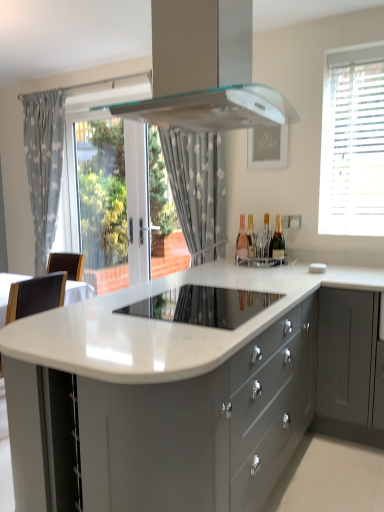
Locate an element on the screen. white blinds at upper right is located at coordinates (352, 142).

Describe the element at coordinates (352, 142) in the screenshot. I see `white blinds at upper right` at that location.

In order to face white glossy countertop at center, should I rotate leftwards or rightwards?

It's best to rotate right around 3.627 degrees.

This screenshot has width=384, height=512. I want to click on matte gold wine bottle at center, which is counted as the second wine bottle, starting from the right, so pyautogui.click(x=265, y=238).

In the scene shown: Measure the distance between high-gloss white cooktop at center and camera.

The depth of high-gloss white cooktop at center is 1.75 meters.

At what (x,y) coordinates should I click in order to perform the action: click on satin silver range hood at upper center. Please return your answer as a coordinate pair (x, y). The height and width of the screenshot is (512, 384). Looking at the image, I should click on click(206, 71).

Identify the location of white blinds at upper right. (352, 142).

What's the angular difference between transparent glass door at left and satin silver range hood at upper center's facing directions?

88.9 degrees separate the facing orientations of transparent glass door at left and satin silver range hood at upper center.

I want to click on window screen lying behind the satin silver range hood at upper center, so click(x=102, y=192).

Are transparent glass door at left and satin silver range hood at upper center making contact?

No, transparent glass door at left is not with satin silver range hood at upper center.

Is the depth of transparent glass door at left less than that of high-gloss white cooktop at center?

No, it is not.

At what (x,y) coordinates should I click in order to perform the action: click on kitchen appliance on the right side of transparent glass door at left. Please return your answer as a coordinate pair (x, y). Looking at the image, I should click on (203, 306).

Which is behind, point (80, 195) or point (237, 314)?

Point (80, 195)

What's the angular difference between transparent glass door at left and white dotted fabric at center, which ranks as the 2th curtain in left-to-right order,'s facing directions?

0.00328 degrees.

From a real-world perspective, who is located lower, transparent glass door at left or white dotted fabric at center, which ranks as the 1th curtain in front-to-back order?

From a 3D spatial view, transparent glass door at left is below.

Is transparent glass door at left far from white dotted fabric at center, placed as the 1th curtain when sorted from right to left?

Indeed, transparent glass door at left is not near white dotted fabric at center, placed as the 1th curtain when sorted from right to left.

Is white dotted fabric at center, which ranks as the 1th curtain in front-to-back order, further to the viewer compared to transparent glass door at center?

No.

In terms of width, does white dotted fabric at center, placed as the 1th curtain when sorted from right to left, look wider or thinner when compared to transparent glass door at center?

In the image, white dotted fabric at center, placed as the 1th curtain when sorted from right to left, appears to be wider than transparent glass door at center.

Would you say white dotted fabric at center, which ranks as the 1th curtain in front-to-back order, is outside transparent glass door at center?

white dotted fabric at center, which ranks as the 1th curtain in front-to-back order, lies outside transparent glass door at center's area.

How far apart are white dotted fabric at center, placed as the 1th curtain when sorted from right to left, and transparent glass door at center?

white dotted fabric at center, placed as the 1th curtain when sorted from right to left, and transparent glass door at center are 7.79 feet apart from each other.

Does white glossy countertop at center lie behind white dotted fabric at center, which ranks as the 2th curtain in left-to-right order?

No, it is in front of white dotted fabric at center, which ranks as the 2th curtain in left-to-right order.

How many degrees apart are the facing directions of white glossy countertop at center and white dotted fabric at center, which ranks as the 2th curtain in left-to-right order?

white glossy countertop at center and white dotted fabric at center, which ranks as the 2th curtain in left-to-right order, are facing 90.5 degrees away from each other.

Starting from the white glossy countertop at center, which curtain is the 1st one behind? Please provide its 2D coordinates.

[(198, 189)]

Measure the distance from white glossy countertop at center to white dotted fabric at center, which is the 2th curtain from back to front.

1.42 meters.

Between black leather chair at left and matte glass wine bottle at center, marked as the third wine bottle in a right-to-left arrangement, which one is positioned in front?

black leather chair at left.

From a real-world perspective, which is physically below, black leather chair at left or matte glass wine bottle at center, marked as the third wine bottle in a right-to-left arrangement?

black leather chair at left is physically lower.

In the scene shown: Who is bigger, black leather chair at left or matte glass wine bottle at center, the 1th wine bottle positioned from the left?

black leather chair at left is bigger.

From a real-world perspective, starting from the pink glass bottle at center, which wine bottle is the 1st one vertically above it? Please provide its 2D coordinates.

[(265, 238)]

From a real-world perspective, relative to pink glass bottle at center, is matte gold wine bottle at center, arranged as the 2th wine bottle when viewed from the left, vertically above or below?

Clearly, from a real-world perspective, matte gold wine bottle at center, arranged as the 2th wine bottle when viewed from the left, is above pink glass bottle at center.

Considering the sizes of objects matte gold wine bottle at center, which is counted as the second wine bottle, starting from the right, and pink glass bottle at center in the image provided, who is smaller, matte gold wine bottle at center, which is counted as the second wine bottle, starting from the right, or pink glass bottle at center?

With smaller size is pink glass bottle at center.

Consider the image. Is matte gold wine bottle at center, arranged as the 2th wine bottle when viewed from the left, taller or shorter than pink glass bottle at center?

matte gold wine bottle at center, arranged as the 2th wine bottle when viewed from the left, is taller than pink glass bottle at center.

This screenshot has height=512, width=384. In the image, there is a transparent glass door at left. What are the coordinates of `home appliance above it (from the image's perspective)` in the screenshot? It's located at (206, 71).

Where is `window screen on the left side of high-gloss white cooktop at center`? The width and height of the screenshot is (384, 512). window screen on the left side of high-gloss white cooktop at center is located at coordinates (102, 192).

Looking at the image, which one is located closer to white dotted fabric at center, which ranks as the 1th curtain in front-to-back order, high-gloss white cooktop at center or transparent glass door at left?

high-gloss white cooktop at center is closer to white dotted fabric at center, which ranks as the 1th curtain in front-to-back order.

When comparing their distances from matte gold wine bottle at center, which appears as the first wine bottle when viewed from the right, does transparent glass door at left or matte gold wine bottle at center, which is counted as the second wine bottle, starting from the right, seem further?

transparent glass door at left is positioned further to the anchor matte gold wine bottle at center, which appears as the first wine bottle when viewed from the right.

When comparing their distances from gray fabric curtain at left, arranged as the 2th curtain when viewed from the right, does transparent glass door at center or black leather chair at left seem further?

black leather chair at left.

Estimate the real-world distances between objects in this image. Which object is closer to pink glass bottle at center, high-gloss white cooktop at center or transparent glass door at center?

high-gloss white cooktop at center is closer to pink glass bottle at center.

Estimate the real-world distances between objects in this image. Which object is further from white dotted fabric at center, which ranks as the 1th curtain in front-to-back order, white blinds at upper right or transparent glass door at center?

transparent glass door at center is further to white dotted fabric at center, which ranks as the 1th curtain in front-to-back order.

Estimate the real-world distances between objects in this image. Which object is closer to satin silver range hood at upper center, pink glass bottle at center or gray fabric curtain at left, the first curtain viewed from the left?

Among the two, pink glass bottle at center is located nearer to satin silver range hood at upper center.

From the image, which object appears to be nearer to white blinds at upper right, black leather chair at left or matte gold wine bottle at center, which appears as the first wine bottle when viewed from the right?

The object closer to white blinds at upper right is matte gold wine bottle at center, which appears as the first wine bottle when viewed from the right.

Looking at the image, which one is located further to matte glass wine bottle at center, marked as the third wine bottle in a right-to-left arrangement, white dotted fabric at center, which is the 2th curtain from back to front, or white glossy countertop at center?

Based on the image, white glossy countertop at center appears to be further to matte glass wine bottle at center, marked as the third wine bottle in a right-to-left arrangement.

In order to click on bottle between transparent glass door at center and matte gold wine bottle at center, which appears as the first wine bottle when viewed from the right, from left to right in this screenshot , I will do `click(242, 241)`.

Image resolution: width=384 pixels, height=512 pixels. What are the coordinates of `curtain located between black leather chair at left and transparent glass door at center in the depth direction` in the screenshot? It's located at (198, 189).

Find the location of a particular element. curtain between transparent glass door at center and matte gold wine bottle at center, which appears as the first wine bottle when viewed from the right is located at coordinates (198, 189).

Identify the location of chair between satin silver range hood at upper center and transparent glass door at left from front to back. tap(35, 296).